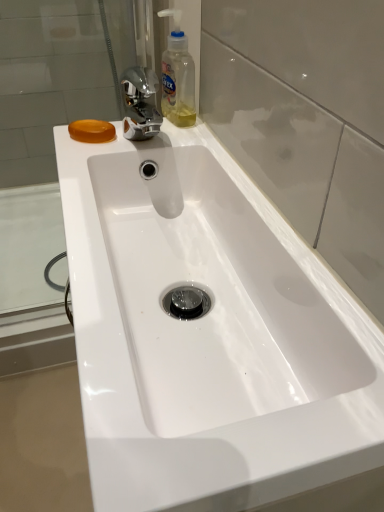
The image size is (384, 512). Find the location of `vacant area located to the right-hand side of orange translucent soap at upper left`. vacant area located to the right-hand side of orange translucent soap at upper left is located at coordinates (187, 143).